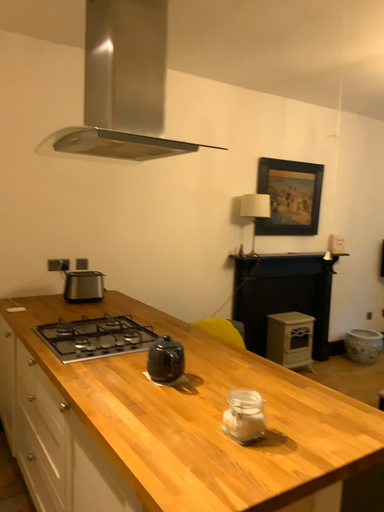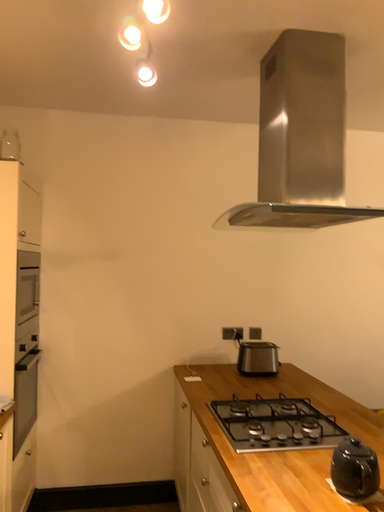
Question: How did the camera likely rotate when shooting the video?

Choices:
 (A) rotated downward
 (B) rotated upward

Answer: (B)